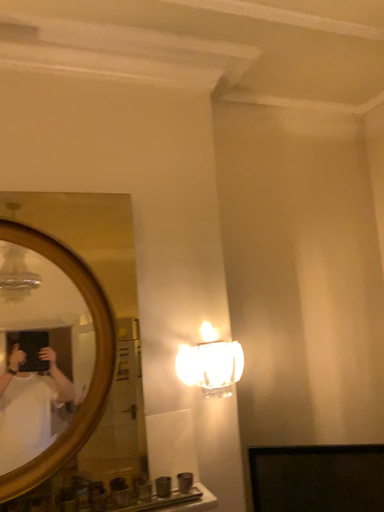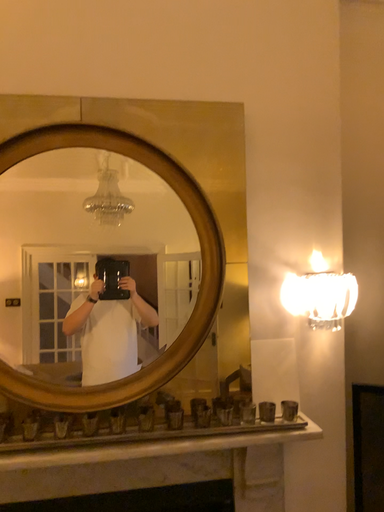
Question: How did the camera likely rotate when shooting the video?

Choices:
 (A) rotated left
 (B) rotated right

Answer: (A)